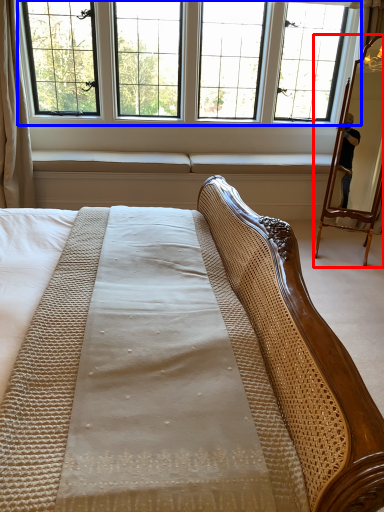
Question: Which object appears farthest to the camera in this image, mirror (highlighted by a red box) or window (highlighted by a blue box)?

Choices:
 (A) mirror
 (B) window

Answer: (B)